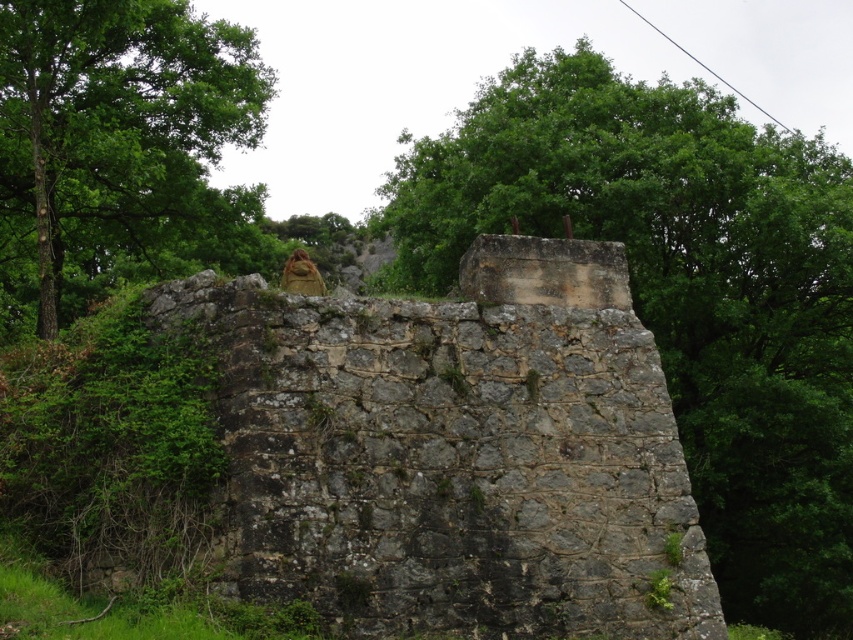
You are standing in front of the weathered stone structure and notice two green leafy trees in the background. Which tree, the green leafy tree at upper center or the green leafy tree at upper left, is located to the right of the other?

The green leafy tree at upper center is positioned on the right side of the green leafy tree at upper left.

You are a photographer standing at the camera position. You want to capture the green leafy tree at upper center in your photo. The camera has a maximum focus range of 130 feet. Will the tree be in focus?

The green leafy tree at upper center is 130.98 feet from camera, which is slightly beyond the camera maximum focus range of 130 feet. The tree will not be in focus.